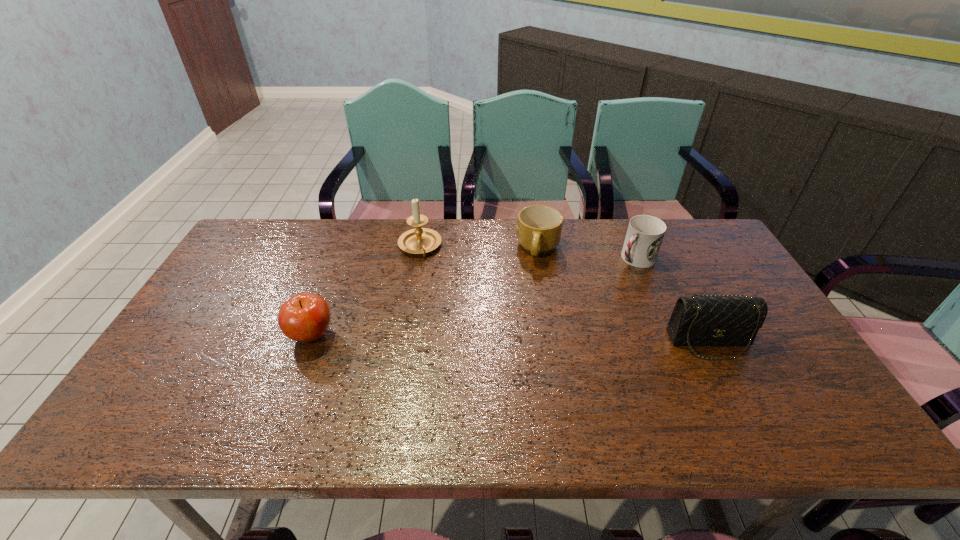
You are a GUI agent. You are given a task and a screenshot of the screen. Output one action in this format:
    pyautogui.click(x=<x>, y=<y>)
    Task: Click on the free space located on the handle side of the cup
    Image resolution: width=960 pixels, height=540 pixels.
    Given the screenshot: What is the action you would take?
    pyautogui.click(x=595, y=293)

The image size is (960, 540). What are the coordinates of `vacant space located with a handle on the side of the candle holder` in the screenshot? It's located at tap(461, 350).

This screenshot has width=960, height=540. Identify the location of vacant space located with a handle on the side of the candle holder. (459, 345).

Image resolution: width=960 pixels, height=540 pixels. Identify the location of free region located with a handle on the side of the candle holder. (462, 353).

The height and width of the screenshot is (540, 960). What are the coordinates of `free space located 0.290m on the side with the handle of the mug` in the screenshot? It's located at (496, 329).

Locate an element on the screen. This screenshot has height=540, width=960. vacant area situated on the side with the handle of the mug is located at coordinates (496, 329).

At what (x,y) coordinates should I click in order to perform the action: click on free space located on the side with the handle of the mug. Please return your answer as a coordinate pair (x, y). This screenshot has height=540, width=960. Looking at the image, I should click on (514, 299).

Where is `cup at the far edge`? The image size is (960, 540). cup at the far edge is located at coordinates (645, 233).

You are a GUI agent. You are given a task and a screenshot of the screen. Output one action in this format:
    pyautogui.click(x=<x>, y=<y>)
    Task: Click on the candle holder located at the far edge
    This screenshot has height=540, width=960.
    Given the screenshot: What is the action you would take?
    pyautogui.click(x=420, y=240)

This screenshot has height=540, width=960. Identify the location of mug located in the far edge section of the desktop. (539, 227).